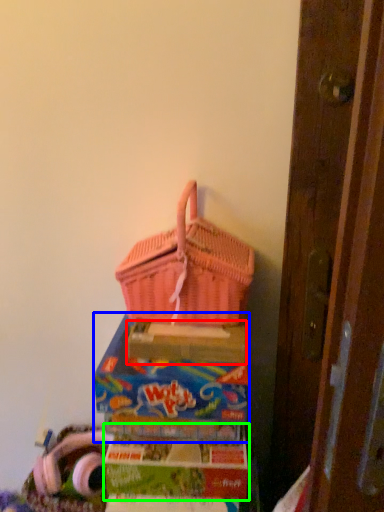
Question: Which is farther away from cardboard box (highlighted by a red box)? box (highlighted by a blue box) or box (highlighted by a green box)?

Choices:
 (A) box
 (B) box

Answer: (B)